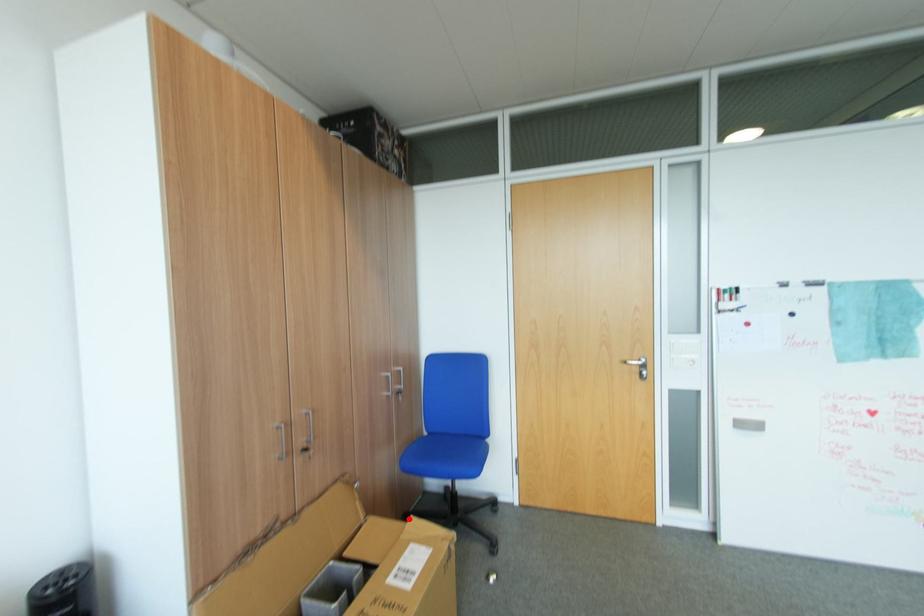
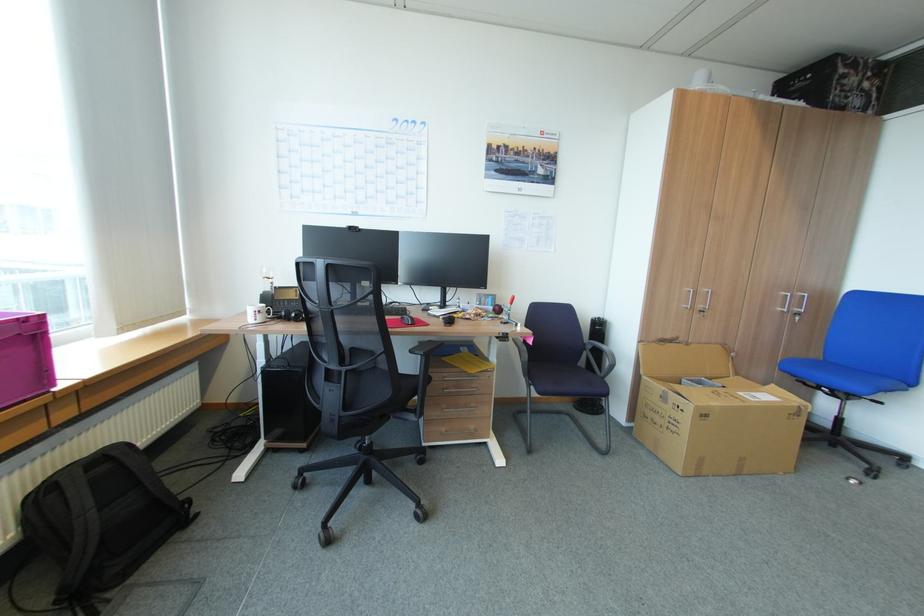
Where in the second image is the point corresponding to the highlighted location from the first image?

(771, 384)